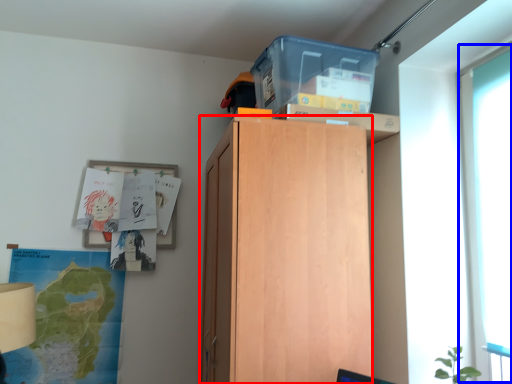
Question: Which point is closer to the camera, cabinetry (highlighted by a red box) or glass door (highlighted by a blue box)?

Choices:
 (A) cabinetry
 (B) glass door

Answer: (B)